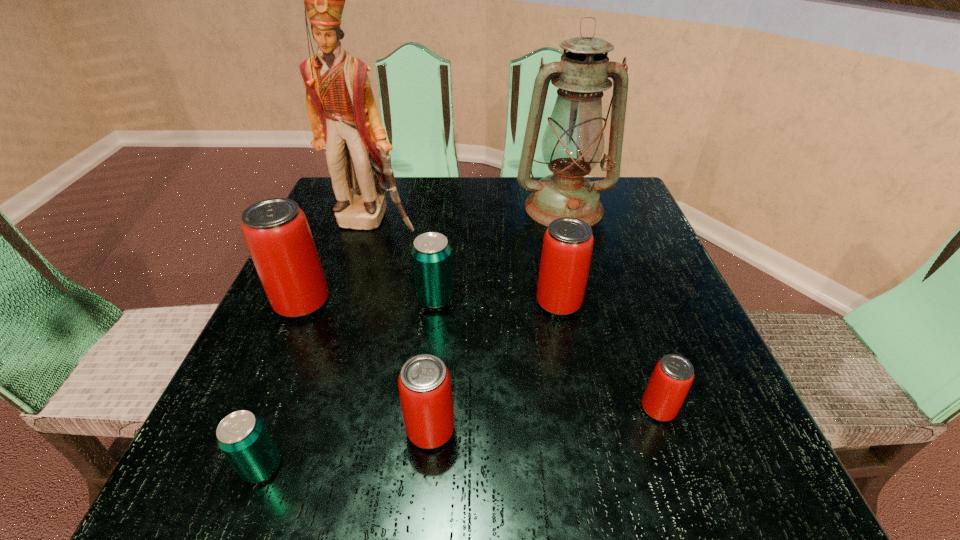
You are a GUI agent. You are given a task and a screenshot of the screen. Output one action in this format:
    pyautogui.click(x=<x>, y=<y>)
    Task: Click on the rightmost beer can
    The width and height of the screenshot is (960, 540).
    Given the screenshot: What is the action you would take?
    pyautogui.click(x=673, y=375)

The width and height of the screenshot is (960, 540). In order to click on the smaller teal beer can in this screenshot , I will do `click(242, 437)`.

Where is `the nearer teal beer can`? This screenshot has height=540, width=960. the nearer teal beer can is located at coordinates (242, 437).

This screenshot has height=540, width=960. Find the location of `vacant space located 0.190m on the front-facing side of the nutcracker`. vacant space located 0.190m on the front-facing side of the nutcracker is located at coordinates (349, 296).

Find the location of a particular element. The width and height of the screenshot is (960, 540). free space located on the left of the oil lamp is located at coordinates (469, 208).

Locate an element on the screen. The image size is (960, 540). vacant space located on the back of the biggest pink beer can is located at coordinates (332, 233).

This screenshot has width=960, height=540. In order to click on vacant space located on the front of the third smallest pink beer can in this screenshot , I will do `click(589, 461)`.

You are a GUI agent. You are given a task and a screenshot of the screen. Output one action in this format:
    pyautogui.click(x=<x>, y=<y>)
    Task: Click on the free space located 0.230m on the left of the bigger teal beer can
    The height and width of the screenshot is (540, 960).
    Given the screenshot: What is the action you would take?
    pyautogui.click(x=294, y=299)

What are the coordinates of `blank space located on the left of the second smallest pink beer can` in the screenshot? It's located at (372, 430).

Where is `vacant space located 0.220m on the back of the smallest pink beer can`? vacant space located 0.220m on the back of the smallest pink beer can is located at coordinates (619, 294).